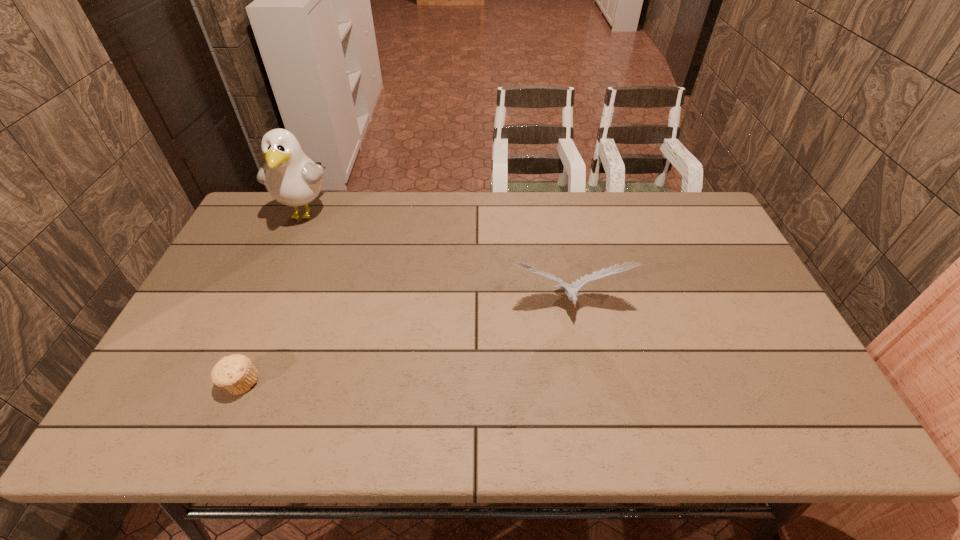
This screenshot has width=960, height=540. I want to click on object positioned at the left edge, so click(292, 178).

This screenshot has width=960, height=540. What are the coordinates of `object situated at the far left corner` in the screenshot? It's located at (292, 178).

Where is `blank space at the far edge`? This screenshot has height=540, width=960. blank space at the far edge is located at coordinates (656, 207).

Find the location of a particular element. This screenshot has width=960, height=540. vacant space at the near edge is located at coordinates (552, 411).

The height and width of the screenshot is (540, 960). In the image, there is a desktop. In order to click on vacant space at the left edge in this screenshot , I will do `click(250, 294)`.

Image resolution: width=960 pixels, height=540 pixels. In order to click on vacant space at the right edge of the desktop in this screenshot , I will do `click(721, 256)`.

The image size is (960, 540). Find the location of `vacant space at the near left corner`. vacant space at the near left corner is located at coordinates (173, 418).

The image size is (960, 540). In order to click on blank area at the far right corner in this screenshot , I will do `click(667, 205)`.

Locate an element on the screen. free point at the near right corner is located at coordinates (785, 435).

This screenshot has width=960, height=540. I want to click on vacant point located between the taller gull and the second farthest object, so click(437, 259).